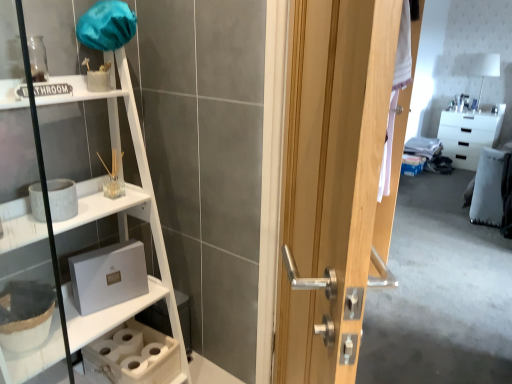
This screenshot has height=384, width=512. I want to click on wooden door at center, so click(332, 181).

What do you see at coordinates (332, 181) in the screenshot? I see `wooden door at center` at bounding box center [332, 181].

Locate an element on the screen. The image size is (512, 384). white glossy cabinet at upper right is located at coordinates (468, 135).

Consider the image. Who is taller, white glossy cabinet at upper right or wooden door at center?

With more height is wooden door at center.

Considering the sizes of objects white glossy cabinet at upper right and wooden door at center in the image provided, who is smaller, white glossy cabinet at upper right or wooden door at center?

white glossy cabinet at upper right.

Can you confirm if white glossy cabinet at upper right is wider than wooden door at center?

Indeed, white glossy cabinet at upper right has a greater width compared to wooden door at center.

The height and width of the screenshot is (384, 512). Find the location of `door on the left of white glossy cabinet at upper right`. door on the left of white glossy cabinet at upper right is located at coordinates 332,181.

From the image's perspective, which one is positioned lower, wooden door at center or white wood shelf at left?

wooden door at center appears lower in the image.

In the scene shown: Is wooden door at center beside white wood shelf at left?

wooden door at center and white wood shelf at left are clearly separated.

Can you confirm if wooden door at center is thinner than white wood shelf at left?

Correct, the width of wooden door at center is less than that of white wood shelf at left.

From a real-world perspective, is wooden door at center physically above white wood shelf at left?

Yes, from a real-world perspective, wooden door at center is above white wood shelf at left.

Identify the location of shelf on the left side of white glossy cabinet at upper right. (116, 215).

Is white glossy cabinet at upper right positioned before white wood shelf at left?

No, it is not.

From the picture: Which object is thinner, white glossy cabinet at upper right or white wood shelf at left?

white glossy cabinet at upper right.

From the image's perspective, does white wood shelf at left appear higher than wooden door at center?

Yes, from the image's perspective, white wood shelf at left is above wooden door at center.

From the picture: From a real-world perspective, who is located lower, white wood shelf at left or wooden door at center?

In real-world perspective, white wood shelf at left is lower.

Is white wood shelf at left oriented towards wooden door at center?

Yes, white wood shelf at left is turned towards wooden door at center.

Relative to wooden door at center, is white wood shelf at left in front or behind?

white wood shelf at left is behind wooden door at center.

Which is behind, point (49, 326) or point (448, 132)?

The point (448, 132) is farther from the camera.

Is the position of white wood shelf at left less distant than that of white glossy cabinet at upper right?

Yes, white wood shelf at left is in front of white glossy cabinet at upper right.

Consider the image. Looking at the image, does white wood shelf at left seem bigger or smaller compared to white glossy cabinet at upper right?

white wood shelf at left is bigger than white glossy cabinet at upper right.

Looking at their sizes, would you say white wood shelf at left is wider or thinner than white glossy cabinet at upper right?

Considering their sizes, white wood shelf at left looks broader than white glossy cabinet at upper right.

Where is `cabinetry on the right of wooden door at center`? The image size is (512, 384). cabinetry on the right of wooden door at center is located at coordinates (468, 135).

Considering the sizes of objects wooden door at center and white glossy cabinet at upper right in the image provided, who is bigger, wooden door at center or white glossy cabinet at upper right?

wooden door at center is bigger.

Relative to white glossy cabinet at upper right, is wooden door at center in front or behind?

Clearly, wooden door at center is in front of white glossy cabinet at upper right.

In the image, there is a wooden door at center. Identify the location of cabinetry below it (from a real-world perspective). The image size is (512, 384). (468, 135).

In the image, there is a white wood shelf at left. At what (x,y) coordinates should I click in order to perform the action: click on door below it (from the image's perspective). Please return your answer as a coordinate pair (x, y). Looking at the image, I should click on (332, 181).

Estimate the real-world distances between objects in this image. Which object is closer to white glossy cabinet at upper right, wooden door at center or white wood shelf at left?

Based on the image, wooden door at center appears to be nearer to white glossy cabinet at upper right.

Considering their positions, is wooden door at center positioned closer to white wood shelf at left than white glossy cabinet at upper right?

Based on the image, wooden door at center appears to be nearer to white wood shelf at left.

When comparing their distances from white glossy cabinet at upper right, does white wood shelf at left or wooden door at center seem closer?

wooden door at center is positioned closer to the anchor white glossy cabinet at upper right.

Based on the photo, which object lies nearer to the anchor point wooden door at center, white wood shelf at left or white glossy cabinet at upper right?

white wood shelf at left is positioned closer to the anchor wooden door at center.

Considering their positions, is white glossy cabinet at upper right positioned further to wooden door at center than white wood shelf at left?

The object further to wooden door at center is white glossy cabinet at upper right.

Estimate the real-world distances between objects in this image. Which object is closer to white wood shelf at left, white glossy cabinet at upper right or wooden door at center?

wooden door at center is positioned closer to the anchor white wood shelf at left.

Where is `shelf between wooden door at center and white glossy cabinet at upper right along the z-axis`? shelf between wooden door at center and white glossy cabinet at upper right along the z-axis is located at coordinates (116, 215).